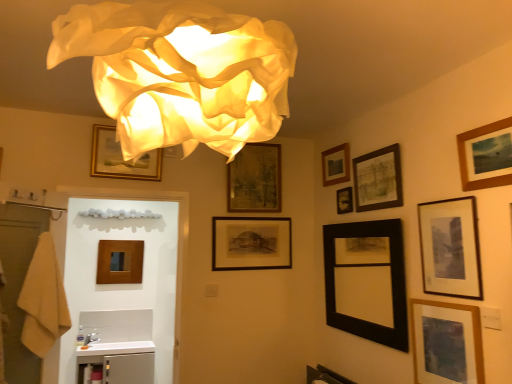
Question: Could you tell me if white glossy counter top at lower left is turned towards gold-framed picture at upper center, which is the tenth picture frame from right to left?

Choices:
 (A) no
 (B) yes

Answer: (A)

Question: From a real-world perspective, is white glossy counter top at lower left located higher than gold-framed picture at upper center, which ranks as the second picture frame in left-to-right order?

Choices:
 (A) yes
 (B) no

Answer: (B)

Question: Is white glossy counter top at lower left positioned behind gold-framed picture at upper center, which is the tenth picture frame from right to left?

Choices:
 (A) yes
 (B) no

Answer: (A)

Question: Considering the relative positions of white glossy counter top at lower left and gold-framed picture at upper center, which ranks as the second picture frame in left-to-right order, in the image provided, is white glossy counter top at lower left to the left of gold-framed picture at upper center, which ranks as the second picture frame in left-to-right order, from the viewer's perspective?

Choices:
 (A) yes
 (B) no

Answer: (A)

Question: Is white glossy counter top at lower left touching gold-framed picture at upper center, which ranks as the second picture frame in left-to-right order?

Choices:
 (A) yes
 (B) no

Answer: (B)

Question: In terms of size, does wooden picture frame at lower right, the third picture frame positioned from the right, appear bigger or smaller than wooden picture frame at center, the first picture frame from the left?

Choices:
 (A) big
 (B) small

Answer: (A)

Question: From the image's perspective, is wooden picture frame at lower right, the third picture frame positioned from the right, located above or below wooden picture frame at center, the first picture frame from the left?

Choices:
 (A) above
 (B) below

Answer: (B)

Question: Relative to wooden picture frame at center, the first picture frame from the left, is wooden picture frame at lower right, the third picture frame positioned from the right, in front or behind?

Choices:
 (A) front
 (B) behind

Answer: (A)

Question: Is wooden picture frame at lower right, the third picture frame positioned from the right, inside the boundaries of wooden picture frame at center, marked as the 11th picture frame in a right-to-left arrangement, or outside?

Choices:
 (A) outside
 (B) inside

Answer: (A)

Question: Considering their positions, is white glossy counter top at lower left located in front of or behind matte black picture frame at upper right, positioned as the 8th picture frame in left-to-right order?

Choices:
 (A) behind
 (B) front

Answer: (A)

Question: Considering the positions of white glossy counter top at lower left and matte black picture frame at upper right, positioned as the fourth picture frame in right-to-left order, in the image, is white glossy counter top at lower left taller or shorter than matte black picture frame at upper right, positioned as the fourth picture frame in right-to-left order,?

Choices:
 (A) short
 (B) tall

Answer: (A)

Question: From the image's perspective, is white glossy counter top at lower left positioned above or below matte black picture frame at upper right, positioned as the 8th picture frame in left-to-right order?

Choices:
 (A) below
 (B) above

Answer: (A)

Question: Considering the positions of point (140, 345) and point (373, 195), is point (140, 345) closer or farther from the camera than point (373, 195)?

Choices:
 (A) farther
 (B) closer

Answer: (A)

Question: Is white fabric lamp at upper center to the left or to the right of black matte picture frame at center, the 3th picture frame when ordered from left to right, in the image?

Choices:
 (A) left
 (B) right

Answer: (A)

Question: Is white fabric lamp at upper center spatially inside black matte picture frame at center, which is counted as the 9th picture frame, starting from the right, or outside of it?

Choices:
 (A) outside
 (B) inside

Answer: (A)